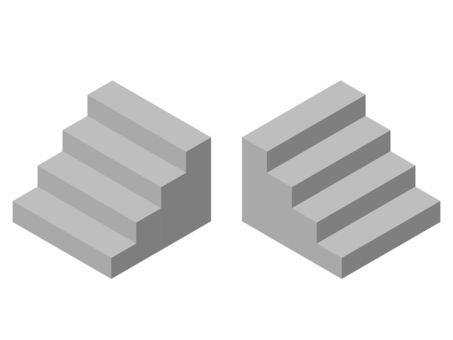
At what (x,y) coordinates should I click in order to perform the action: click on stair steps. Please return your answer as a coordinate pair (x, y). This screenshot has height=340, width=453. Looking at the image, I should click on (84, 234), (121, 200), (151, 165), (173, 128), (280, 125), (332, 147), (362, 183), (378, 223).